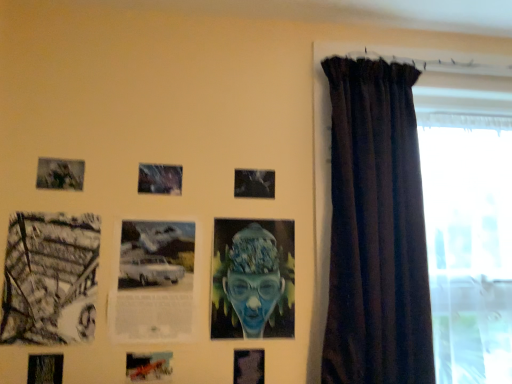
Locate an element on the screen. The height and width of the screenshot is (384, 512). white paper with printed text at center, which is the 6th picture frame from left to right is located at coordinates (155, 282).

This screenshot has height=384, width=512. What do you see at coordinates (468, 247) in the screenshot?
I see `transparent glass window at right` at bounding box center [468, 247].

Measure the distance between metallic silver car at center, which is counted as the fifth picture frame, starting from the left, and camera.

A distance of 1.46 meters exists between metallic silver car at center, which is counted as the fifth picture frame, starting from the left, and camera.

In order to face metallic silver picture frame at lower center, which is counted as the fifth picture frame, starting from the right, should I rotate leftwards or rightwards?

It's best to rotate left around 13.831 degrees.

The height and width of the screenshot is (384, 512). Identify the location of metallic silver picture frame at lower center, acting as the fourth picture frame starting from the left. (149, 366).

Locate an element on the screen. This screenshot has height=384, width=512. blue textured portrait at center is located at coordinates (253, 279).

Considering the positions of points (469, 312) and (223, 305), is point (469, 312) farther from camera compared to point (223, 305)?

Yes, point (469, 312) is farther from viewer.

Could blue textured portrait at center be considered to be inside transparent glass window at right?

Definitely not — blue textured portrait at center is not inside transparent glass window at right.

Which of these two, white paper with printed text at center, which is the 6th picture frame from left to right, or transparent glass window at right, stands taller?

With more height is transparent glass window at right.

Which point is more distant from viewer, (161, 236) or (424, 126)?

The point (424, 126) is more distant.

Is white paper with printed text at center, which is the 6th picture frame from left to right, facing away from transparent glass window at right?

No, white paper with printed text at center, which is the 6th picture frame from left to right, is not facing the opposite direction of transparent glass window at right.

Measure the distance between white paper with printed text at center, which is the 6th picture frame from left to right, and transparent glass window at right.

1.05 meters.

Does metallic silver picture frame at lower center, acting as the fourth picture frame starting from the left, have a smaller size compared to dark velvet curtain at right?

Indeed, metallic silver picture frame at lower center, acting as the fourth picture frame starting from the left, has a smaller size compared to dark velvet curtain at right.

From a real-world perspective, is metallic silver picture frame at lower center, which is counted as the fifth picture frame, starting from the right, positioned under dark velvet curtain at right based on gravity?

Yes, from a real-world perspective, metallic silver picture frame at lower center, which is counted as the fifth picture frame, starting from the right, is under dark velvet curtain at right.

From the image's perspective, which object appears higher, metallic silver picture frame at lower center, which is counted as the fifth picture frame, starting from the right, or dark velvet curtain at right?

From the image's view, dark velvet curtain at right is above.

Looking at this image, is metallic silver picture frame at lower center, acting as the fourth picture frame starting from the left, aimed at dark velvet curtain at right?

No, metallic silver picture frame at lower center, acting as the fourth picture frame starting from the left, does not turn towards dark velvet curtain at right.

Which of these two, matte black photo frame at center, acting as the 1th picture frame starting from the right, or black and white photograph at left, acting as the 7th picture frame starting from the right, is wider?

Wider between the two is black and white photograph at left, acting as the 7th picture frame starting from the right.

Can black and white photograph at left, acting as the 7th picture frame starting from the right, be found inside matte black photo frame at center, acting as the 1th picture frame starting from the right?

No, black and white photograph at left, acting as the 7th picture frame starting from the right, is not a part of matte black photo frame at center, acting as the 1th picture frame starting from the right.

From a real-world perspective, between matte black photo frame at center, acting as the 1th picture frame starting from the right, and black and white photograph at left, acting as the 7th picture frame starting from the right, who is vertically higher?

In real-world perspective, matte black photo frame at center, acting as the 1th picture frame starting from the right, is above.

Is matte black photo frame at center, acting as the 1th picture frame starting from the right, placed right next to black and white photograph at left, acting as the 7th picture frame starting from the right?

No, matte black photo frame at center, acting as the 1th picture frame starting from the right, is not in contact with black and white photograph at left, acting as the 7th picture frame starting from the right.

Are white paper with printed text at center, positioned as the third picture frame in right-to-left order, and blue textured portrait at center far apart?

No, white paper with printed text at center, positioned as the third picture frame in right-to-left order, is not far away from blue textured portrait at center.

Considering the positions of objects white paper with printed text at center, positioned as the third picture frame in right-to-left order, and blue textured portrait at center in the image provided, who is behind, white paper with printed text at center, positioned as the third picture frame in right-to-left order, or blue textured portrait at center?

blue textured portrait at center is behind.

Is white paper with printed text at center, positioned as the third picture frame in right-to-left order, turned away from blue textured portrait at center?

No, white paper with printed text at center, positioned as the third picture frame in right-to-left order, is not facing the opposite direction of blue textured portrait at center.

Which object is wider, white paper with printed text at center, positioned as the third picture frame in right-to-left order, or blue textured portrait at center?

With larger width is blue textured portrait at center.

The height and width of the screenshot is (384, 512). I want to click on picture frame that is the 6th one when counting backward from the matte black picture frame at lower left, which ranks as the 8th picture frame in right-to-left order, so click(254, 183).

From the picture: Is matte black picture frame at lower left, which ranks as the 8th picture frame in right-to-left order, directly adjacent to matte black photo frame at center, acting as the 1th picture frame starting from the right?

matte black picture frame at lower left, which ranks as the 8th picture frame in right-to-left order, and matte black photo frame at center, acting as the 1th picture frame starting from the right, are clearly separated.

From the image's perspective, is matte black picture frame at lower left, which ranks as the 8th picture frame in right-to-left order, located beneath matte black photo frame at center, the 8th picture frame from the left?

→ Correct, matte black picture frame at lower left, which ranks as the 8th picture frame in right-to-left order, appears lower than matte black photo frame at center, the 8th picture frame from the left, in the image.

Which of these two, matte black photo frame at center, acting as the 1th picture frame starting from the right, or dark velvet curtain at right, is thinner?

matte black photo frame at center, acting as the 1th picture frame starting from the right, is thinner.

Which point is more distant from viewer, (251, 193) or (362, 58)?

The point (362, 58) is farther from the camera.

Is matte black photo frame at center, acting as the 1th picture frame starting from the right, in front of or behind dark velvet curtain at right in the image?

In the image, matte black photo frame at center, acting as the 1th picture frame starting from the right, appears behind dark velvet curtain at right.

At what (x,y) coordinates should I click in order to perform the action: click on curtain below the matte black photo frame at center, the 8th picture frame from the left (from the image's perspective). Please return your answer as a coordinate pair (x, y). Looking at the image, I should click on (376, 230).

Where is `person below the transparent glass window at right (from the image's perspective)`? This screenshot has width=512, height=384. person below the transparent glass window at right (from the image's perspective) is located at coordinates (253, 279).

The height and width of the screenshot is (384, 512). What are the coordinates of `window above the white paper with printed text at center, which is the 6th picture frame from left to right (from the image's perspective)` in the screenshot? It's located at (468, 247).

Estimate the real-world distances between objects in this image. Which object is further from matte black picture frame at lower center, which ranks as the 2th picture frame in right-to-left order, matte black photo frame at center, acting as the 1th picture frame starting from the right, or metallic silver picture frame at lower center, which is counted as the fifth picture frame, starting from the right?

Among the two, matte black photo frame at center, acting as the 1th picture frame starting from the right, is located further to matte black picture frame at lower center, which ranks as the 2th picture frame in right-to-left order.

Looking at this image, considering their positions, is matte black photo frame at center, acting as the 1th picture frame starting from the right, positioned closer to dark velvet curtain at right than metallic silver picture frame at lower center, acting as the fourth picture frame starting from the left?

Based on the image, matte black photo frame at center, acting as the 1th picture frame starting from the right, appears to be nearer to dark velvet curtain at right.

When comparing their distances from matte black picture frame at lower center, the 7th picture frame when ordered from left to right, does blue textured portrait at center or white paper with printed text at center, positioned as the third picture frame in right-to-left order, seem closer?

blue textured portrait at center is positioned closer to the anchor matte black picture frame at lower center, the 7th picture frame when ordered from left to right.

When comparing their distances from matte black photo frame at upper left, the sixth picture frame positioned from the right, does black and white photograph at left, acting as the 7th picture frame starting from the right, or matte black picture frame at lower center, the 7th picture frame when ordered from left to right, seem further?

matte black picture frame at lower center, the 7th picture frame when ordered from left to right, lies further to matte black photo frame at upper left, the sixth picture frame positioned from the right, than the other object.

Consider the image. Considering their positions, is matte black photo frame at center, acting as the 1th picture frame starting from the right, positioned further to metallic silver picture frame at lower center, acting as the fourth picture frame starting from the left, than matte black picture frame at lower center, the 7th picture frame when ordered from left to right?

matte black photo frame at center, acting as the 1th picture frame starting from the right, lies further to metallic silver picture frame at lower center, acting as the fourth picture frame starting from the left, than the other object.

Estimate the real-world distances between objects in this image. Which object is closer to black and white photograph at left, placed as the second picture frame when sorted from left to right, transparent glass window at right or matte black picture frame at lower center, the 7th picture frame when ordered from left to right?

The object closer to black and white photograph at left, placed as the second picture frame when sorted from left to right, is matte black picture frame at lower center, the 7th picture frame when ordered from left to right.

Estimate the real-world distances between objects in this image. Which object is closer to black and white photograph at left, placed as the second picture frame when sorted from left to right, white paper with printed text at center, positioned as the third picture frame in right-to-left order, or dark velvet curtain at right?

Based on the image, white paper with printed text at center, positioned as the third picture frame in right-to-left order, appears to be nearer to black and white photograph at left, placed as the second picture frame when sorted from left to right.

When comparing their distances from matte black photo frame at center, the 8th picture frame from the left, does matte black photo frame at upper left, the sixth picture frame positioned from the right, or white paper with printed text at center, which is the 6th picture frame from left to right, seem further?

The object further to matte black photo frame at center, the 8th picture frame from the left, is matte black photo frame at upper left, the sixth picture frame positioned from the right.

You are a GUI agent. You are given a task and a screenshot of the screen. Output one action in this format:
    pyautogui.click(x=<x>, y=<y>)
    Task: Click on the person situated between black and white photograph at left, placed as the second picture frame when sorted from left to right, and transparent glass window at right from left to right
    
    Given the screenshot: What is the action you would take?
    pyautogui.click(x=253, y=279)

Find the location of a particular element. This screenshot has width=512, height=384. person between white paper with printed text at center, which is the 6th picture frame from left to right, and transparent glass window at right from left to right is located at coordinates (253, 279).

I want to click on curtain between matte black photo frame at center, the 8th picture frame from the left, and matte black picture frame at lower center, which ranks as the 2th picture frame in right-to-left order, in the up-down direction, so click(376, 230).

In order to click on curtain located between matte black picture frame at lower left, which ranks as the 8th picture frame in right-to-left order, and transparent glass window at right in the left-right direction in this screenshot , I will do `click(376, 230)`.